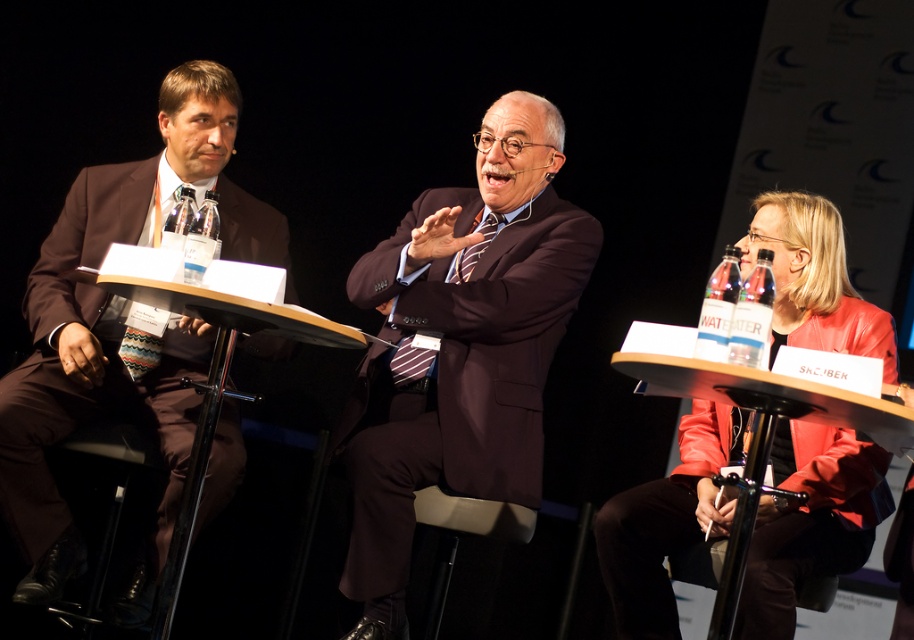
You are a photographer setting up for a panel discussion. You need to adjust the height of the microphone stands so that both the brown suit at left and the leather jacket at right can speak comfortably. Which microphone stand should you raise more?

The brown suit at left is much taller than the leather jacket at right, so you should raise the microphone stand for the brown suit at left more to accommodate his height.